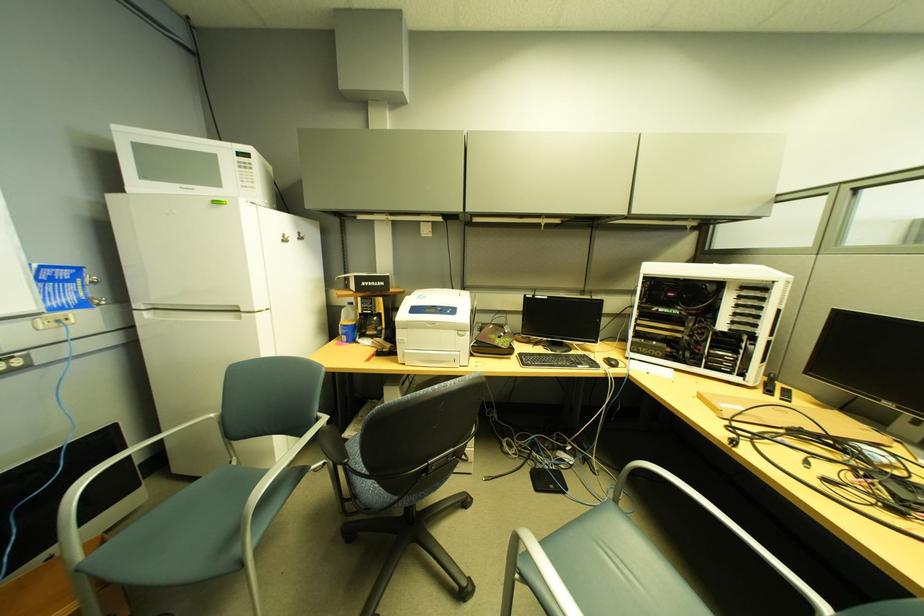
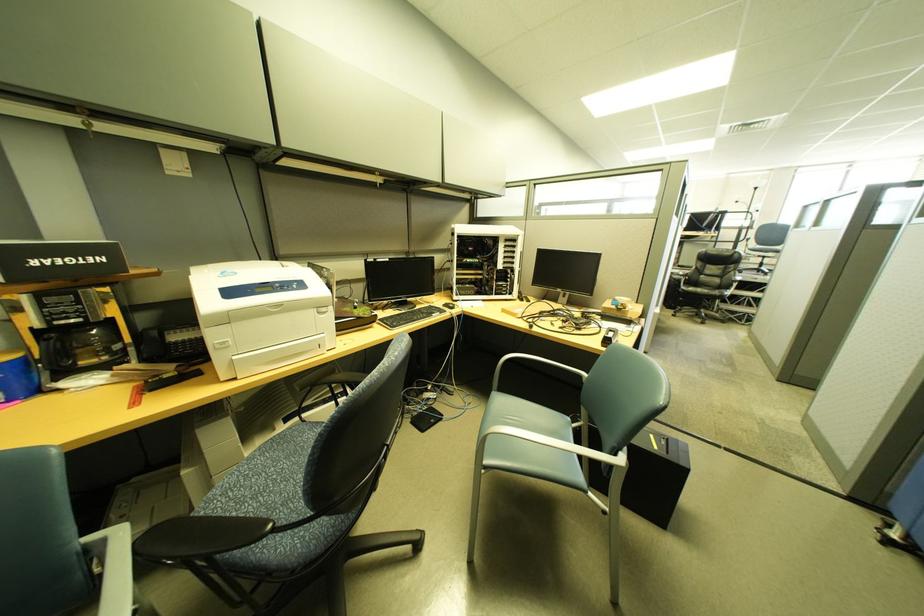
Question: The images are taken continuously from a first-person perspective. In which direction is your viewpoint rotating?

Choices:
 (A) Left
 (B) Right
 (C) Up
 (D) Down

Answer: (B)